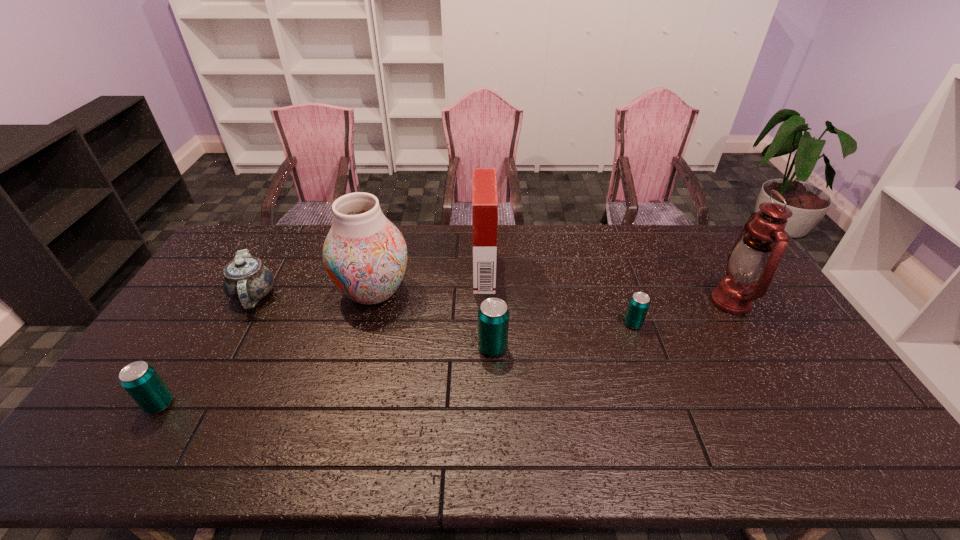
At what (x,y) coordinates should I click in order to perform the action: click on free space located 0.280m on the right of the nearest object. Please return your answer as a coordinate pair (x, y). The image size is (960, 540). Looking at the image, I should click on (282, 404).

Find the location of a particular element. Image resolution: width=960 pixels, height=540 pixels. vacant position located 0.340m on the right of the second beer can from right to left is located at coordinates (625, 348).

Find the location of a particular element. vacant space situated 0.290m on the back of the shortest object is located at coordinates (610, 259).

Where is `vacant space located on the front-facing side of the cigarette_case`? vacant space located on the front-facing side of the cigarette_case is located at coordinates click(427, 272).

This screenshot has height=540, width=960. Identify the location of vacant space located 0.050m on the front-facing side of the cigarette_case. (460, 272).

At what (x,y) coordinates should I click in order to perform the action: click on free space located on the front-facing side of the cigarette_case. Please return your answer as a coordinate pair (x, y). The width and height of the screenshot is (960, 540). Looking at the image, I should click on (x=450, y=272).

At what (x,y) coordinates should I click in order to perform the action: click on vacant space located on the left of the fifth object from right to left. Please return your answer as a coordinate pair (x, y). Looking at the image, I should click on (238, 292).

Find the location of a particular element. The image size is (960, 540). vacant space located on the back of the rightmost object is located at coordinates coord(699,250).

Image resolution: width=960 pixels, height=540 pixels. What are the coordinates of `vacant space located 0.220m from the spout of the chinaware` in the screenshot? It's located at (206, 380).

Locate an element on the screen. object located at the far edge is located at coordinates pyautogui.click(x=485, y=200).